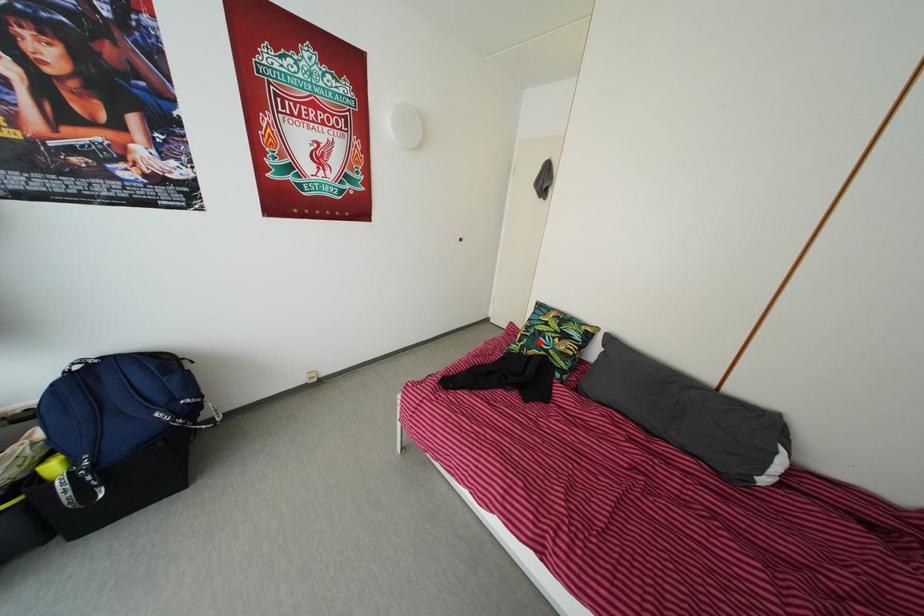
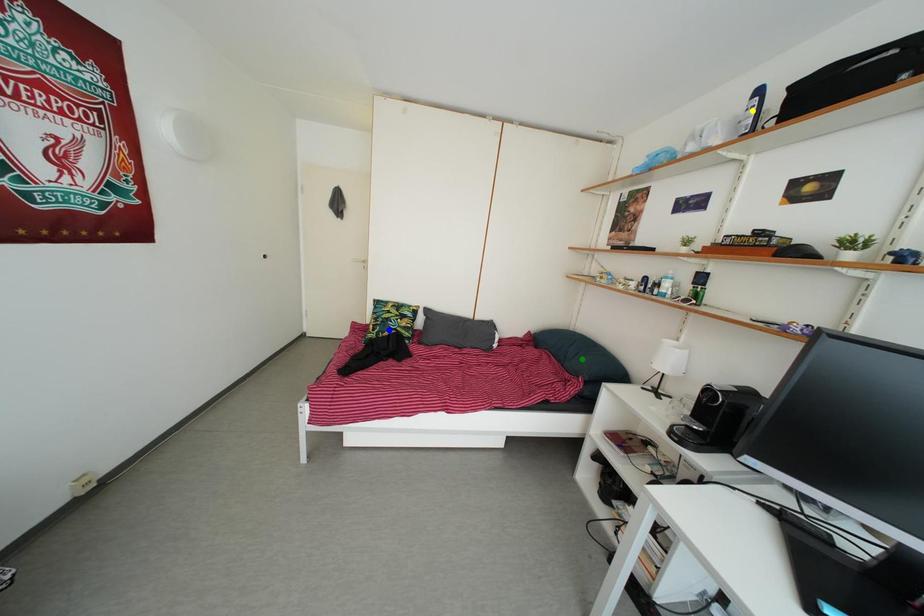
Question: I am providing you with two images of the same scene from different viewpoints. A red point is marked on the first image. You are given multiple points on the second image. Which mark in image 2 goes with the point in image 1?

Choices:
 (A) blue point
 (B) yellow point
 (C) green point

Answer: (A)